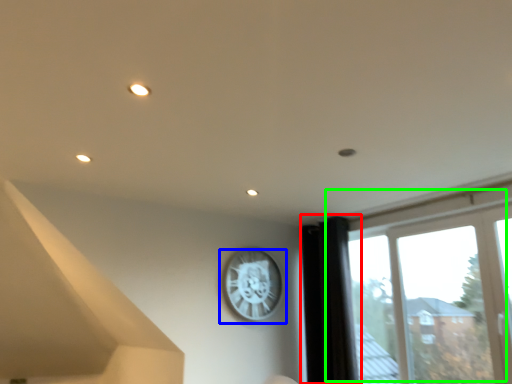
Question: Based on their relative distances, which object is farther from curtain (highlighted by a red box)? Choose from wall clock (highlighted by a blue box) and window (highlighted by a green box).

Choices:
 (A) wall clock
 (B) window

Answer: (A)